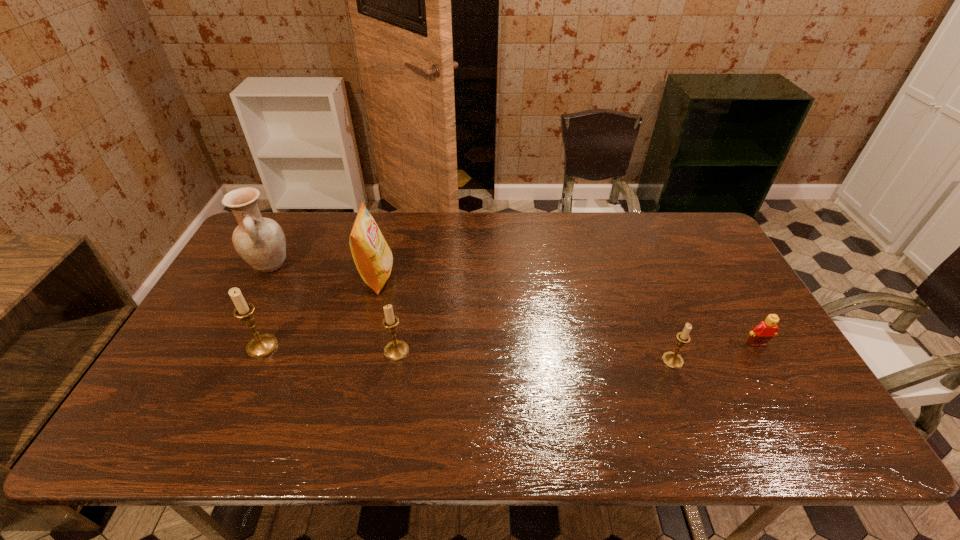
What are the coordinates of `blank region between the pottery and the tallest candle holder` in the screenshot? It's located at (266, 306).

At what (x,y) coordinates should I click in order to perform the action: click on vacant space that's between the Lego and the rightmost candle holder. Please return your answer as a coordinate pair (x, y). Image resolution: width=960 pixels, height=540 pixels. Looking at the image, I should click on (714, 353).

The image size is (960, 540). Find the location of `free spot between the third object from left to right and the tallest candle holder`. free spot between the third object from left to right and the tallest candle holder is located at coordinates (320, 312).

Where is `object that can be found as the closest to the second shortest candle holder`? The height and width of the screenshot is (540, 960). object that can be found as the closest to the second shortest candle holder is located at coordinates (373, 258).

You are a GUI agent. You are given a task and a screenshot of the screen. Output one action in this format:
    pyautogui.click(x=<x>, y=<y>)
    Task: Click on the fifth closest object to the rightmost candle holder
    
    Given the screenshot: What is the action you would take?
    pyautogui.click(x=260, y=241)

At what (x,y) coordinates should I click in order to perform the action: click on candle holder that stands as the third closest to the Lego. Please return your answer as a coordinate pair (x, y). The height and width of the screenshot is (540, 960). Looking at the image, I should click on (260, 346).

Locate an element on the screen. candle holder that is the closest one to the rightmost object is located at coordinates (671, 359).

This screenshot has width=960, height=540. In order to click on vacant area that satisfies the following two spatial constraints: 1. on the front side of the tallest candle holder; 2. on the right side of the pottery in this screenshot , I will do `click(227, 347)`.

Identify the location of vacant space that satisfies the following two spatial constraints: 1. on the back side of the second candle holder from left to right; 2. on the front-facing side of the third object from left to right. tap(409, 276).